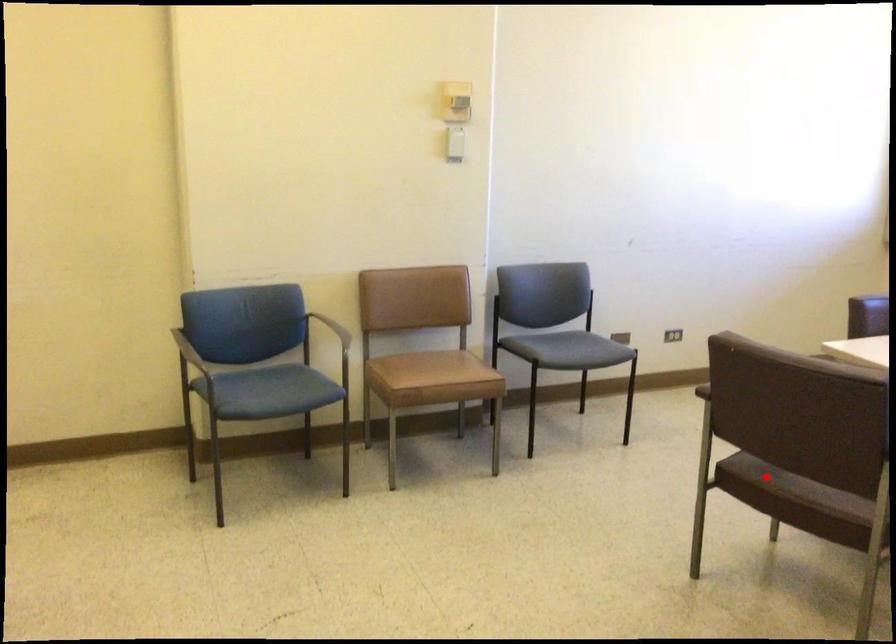
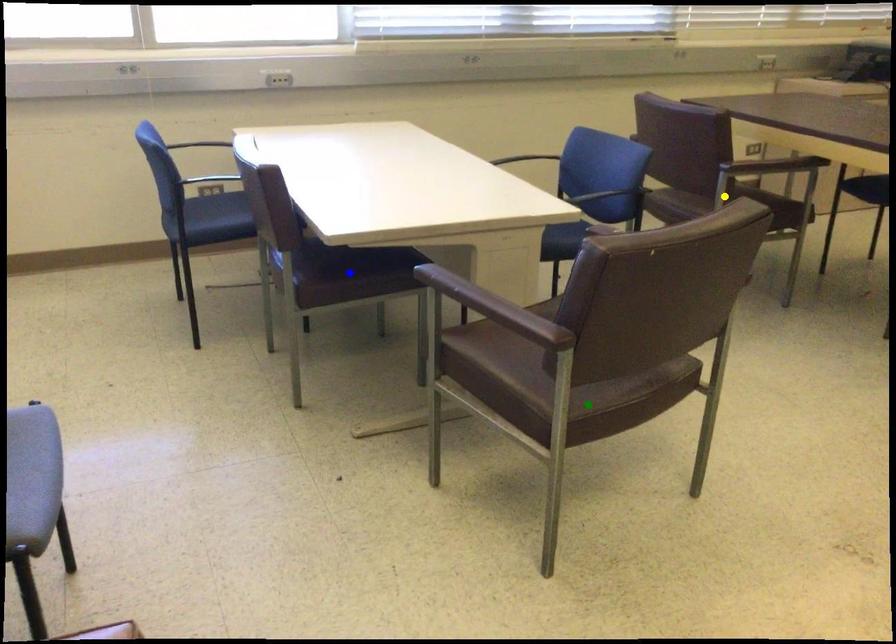
Question: I am providing you with two images of the same scene from different viewpoints. A red point is marked on the first image. You are given multiple points on the second image. Can you choose the point in image 2 that corresponds to the point in image 1?

Choices:
 (A) yellow point
 (B) green point
 (C) blue point

Answer: (B)